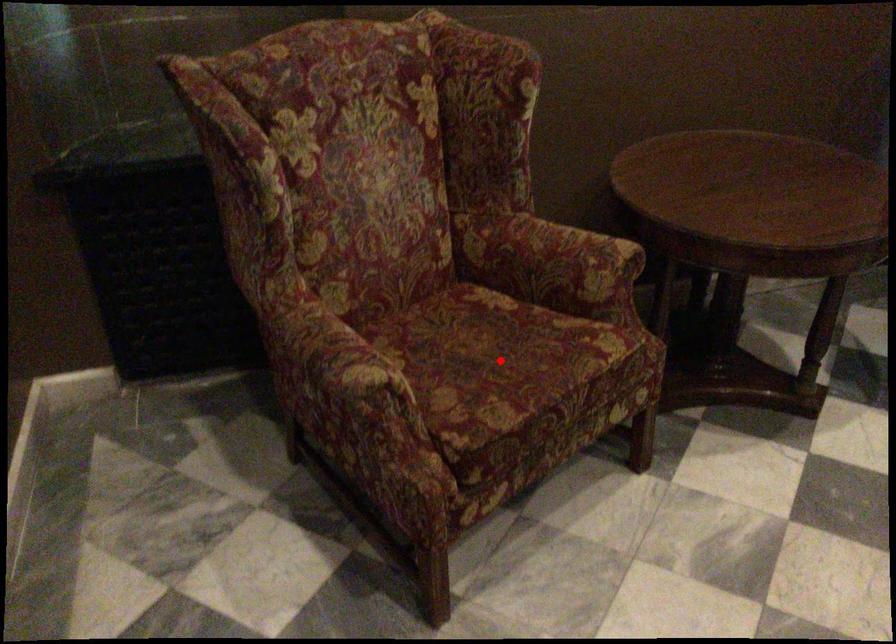
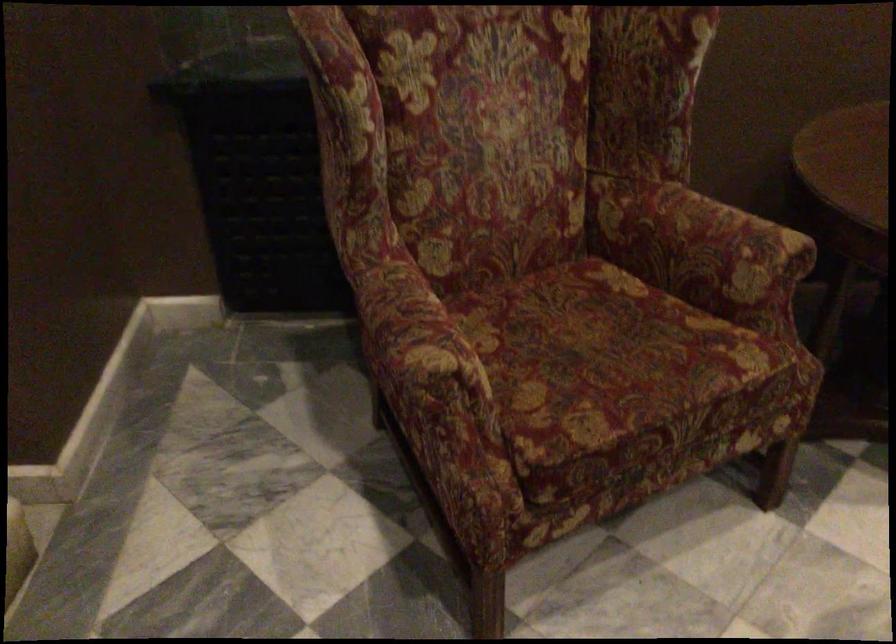
Locate, in the second image, the point that corresponds to the highlighted location in the first image.

(606, 361)